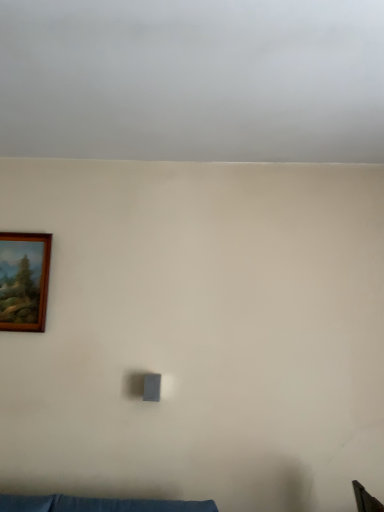
Describe the element at coordinates (24, 281) in the screenshot. I see `wooden picture frame at upper left` at that location.

In order to face wooden picture frame at upper left, should I rotate leftwards or rightwards?

Rotate your view left by about 21.810°.

Where is `wooden picture frame at upper left`? wooden picture frame at upper left is located at coordinates (x=24, y=281).

Locate an element on the screen. The image size is (384, 512). gray matte cloud at upper center is located at coordinates (193, 80).

What do you see at coordinates (193, 80) in the screenshot? The image size is (384, 512). I see `gray matte cloud at upper center` at bounding box center [193, 80].

The width and height of the screenshot is (384, 512). In order to click on wooden picture frame at upper left in this screenshot , I will do `click(24, 281)`.

Which object is positioned more to the right, gray matte cloud at upper center or wooden picture frame at upper left?

From the viewer's perspective, gray matte cloud at upper center appears more on the right side.

Considering the positions of objects gray matte cloud at upper center and wooden picture frame at upper left in the image provided, who is in front, gray matte cloud at upper center or wooden picture frame at upper left?

gray matte cloud at upper center is closer to the camera.

Is point (262, 102) positioned behind point (41, 271)?

That is False.

Looking at this image, from the image's perspective, does gray matte cloud at upper center appear higher than wooden picture frame at upper left?

Yes.

From a real-world perspective, is gray matte cloud at upper center positioned above or below wooden picture frame at upper left?

gray matte cloud at upper center is situated higher than wooden picture frame at upper left in the real world.

Considering the relative sizes of gray matte cloud at upper center and wooden picture frame at upper left in the image provided, is gray matte cloud at upper center thinner than wooden picture frame at upper left?

No.

Which of these two, gray matte cloud at upper center or wooden picture frame at upper left, stands taller?

wooden picture frame at upper left is taller.

Can you confirm if gray matte cloud at upper center is bigger than wooden picture frame at upper left?

Yes.

Which is correct: gray matte cloud at upper center is inside wooden picture frame at upper left, or outside of it?

The correct answer is: outside.

Are gray matte cloud at upper center and wooden picture frame at upper left beside each other?

No, gray matte cloud at upper center is not making contact with wooden picture frame at upper left.

Is gray matte cloud at upper center facing away from wooden picture frame at upper left?

No.

How different are the orientations of gray matte cloud at upper center and wooden picture frame at upper left in degrees?

89.4 degrees separate the facing orientations of gray matte cloud at upper center and wooden picture frame at upper left.

Measure the distance between gray matte cloud at upper center and wooden picture frame at upper left.

gray matte cloud at upper center is 3.70 feet from wooden picture frame at upper left.

At what (x,y) coordinates should I click in order to perform the action: click on cloud located in front of the wooden picture frame at upper left. Please return your answer as a coordinate pair (x, y). This screenshot has width=384, height=512. Looking at the image, I should click on (193, 80).

Which object is positioned more to the right, wooden picture frame at upper left or gray matte cloud at upper center?

From the viewer's perspective, gray matte cloud at upper center appears more on the right side.

Relative to gray matte cloud at upper center, is wooden picture frame at upper left in front or behind?

wooden picture frame at upper left is positioned farther from the viewer than gray matte cloud at upper center.

Is point (9, 251) closer to viewer compared to point (12, 119)?

No, it is behind (12, 119).

From the image's perspective, is wooden picture frame at upper left located above or below gray matte cloud at upper center?

From the image's perspective, wooden picture frame at upper left appears below gray matte cloud at upper center.

From a real-world perspective, is wooden picture frame at upper left positioned under gray matte cloud at upper center based on gravity?

Yes, from a real-world perspective, wooden picture frame at upper left is under gray matte cloud at upper center.

Between wooden picture frame at upper left and gray matte cloud at upper center, which one has smaller width?

wooden picture frame at upper left.

Between wooden picture frame at upper left and gray matte cloud at upper center, which one has more height?

Standing taller between the two is wooden picture frame at upper left.

Can you confirm if wooden picture frame at upper left is smaller than gray matte cloud at upper center?

Yes.

Would you say gray matte cloud at upper center is part of wooden picture frame at upper left's contents?

Definitely not — gray matte cloud at upper center is not inside wooden picture frame at upper left.

Does wooden picture frame at upper left touch gray matte cloud at upper center?

wooden picture frame at upper left and gray matte cloud at upper center are not in contact.

Does wooden picture frame at upper left turn towards gray matte cloud at upper center?

No.

From the picture: Can you tell me how much wooden picture frame at upper left and gray matte cloud at upper center differ in facing direction?

89.4 degrees separate the facing orientations of wooden picture frame at upper left and gray matte cloud at upper center.

You are a GUI agent. You are given a task and a screenshot of the screen. Output one action in this format:
    pyautogui.click(x=<x>, y=<y>)
    Task: Click on the picture frame lying on the left of gray matte cloud at upper center
    This screenshot has width=384, height=512.
    Given the screenshot: What is the action you would take?
    pyautogui.click(x=24, y=281)

At what (x,y) coordinates should I click in order to perform the action: click on cloud positioned vertically above the wooden picture frame at upper left (from a real-world perspective). Please return your answer as a coordinate pair (x, y). This screenshot has width=384, height=512. Looking at the image, I should click on (193, 80).

Where is `cloud in front of the wooden picture frame at upper left`? cloud in front of the wooden picture frame at upper left is located at coordinates (193, 80).